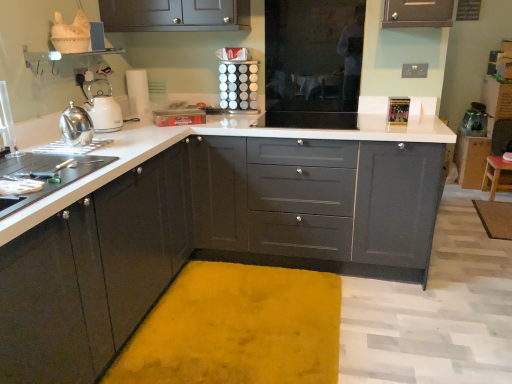
At what (x,y) coordinates should I click in order to perform the action: click on free spot to the right of white glossy kettle at left, which is counted as the 2th kitchen appliance, starting from the front. Please return your answer as a coordinate pair (x, y). The width and height of the screenshot is (512, 384). Looking at the image, I should click on (142, 130).